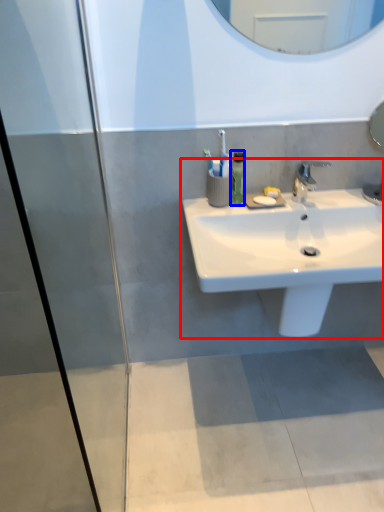
Question: Which point is closer to the camera, sink (highlighted by a red box) or soap dispenser (highlighted by a blue box)?

Choices:
 (A) sink
 (B) soap dispenser

Answer: (A)